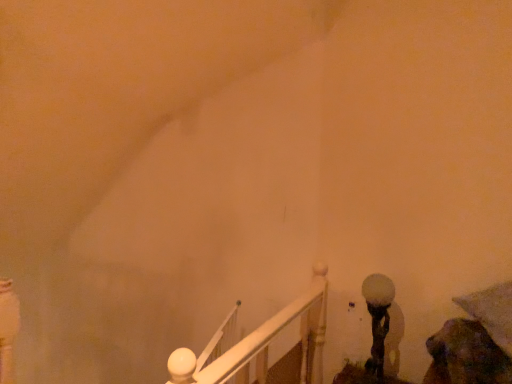
Question: Should I look upward or downward to see white frosted glass lamp at lower right?

Choices:
 (A) up
 (B) down

Answer: (B)